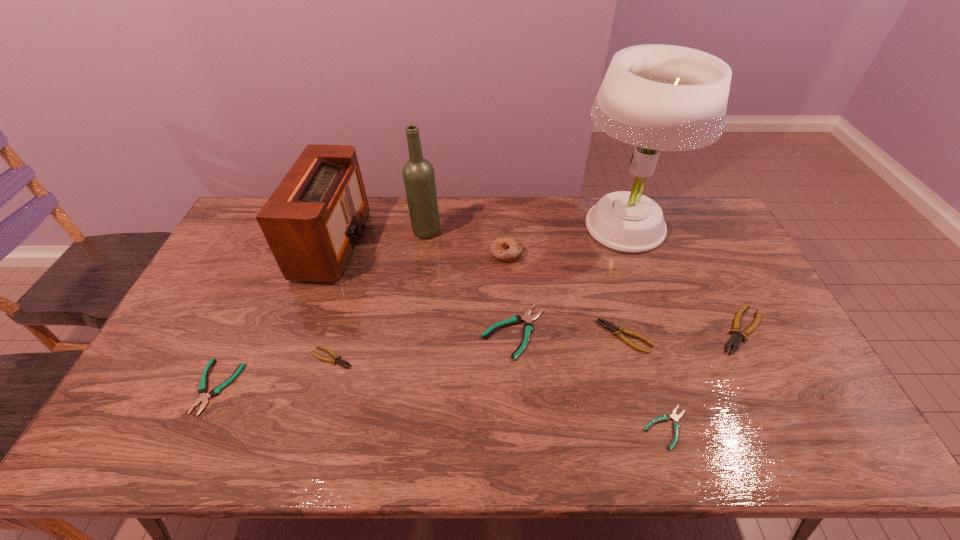
At what (x,y) coordinates should I click in order to perform the action: click on object present at the near edge. Please return your answer as a coordinate pair (x, y). The width and height of the screenshot is (960, 540). Looking at the image, I should click on (676, 425).

The image size is (960, 540). In order to click on object that is at the left edge in this screenshot , I will do `click(202, 389)`.

You are a GUI agent. You are given a task and a screenshot of the screen. Output one action in this format:
    pyautogui.click(x=<x>, y=<y>)
    Task: Click on the object present at the right edge
    The image size is (960, 540).
    Given the screenshot: What is the action you would take?
    pyautogui.click(x=735, y=339)

Find the location of a particular element. Image resolution: width=960 pixels, height=540 pixels. vacant position at the far edge of the desktop is located at coordinates (576, 212).

The width and height of the screenshot is (960, 540). Identify the location of vacant space at the near edge. (756, 432).

Locate an element on the screen. This screenshot has height=540, width=960. vacant region at the left edge is located at coordinates (228, 312).

You are a GUI agent. You are given a task and a screenshot of the screen. Output one action in this format:
    pyautogui.click(x=<x>, y=<y>)
    Task: Click on the blank space at the right edge
    This screenshot has height=540, width=960.
    Given the screenshot: What is the action you would take?
    pyautogui.click(x=703, y=253)

Where is `free area in between the fourth tallest object and the biggest teal pliers`? This screenshot has height=540, width=960. free area in between the fourth tallest object and the biggest teal pliers is located at coordinates (510, 293).

This screenshot has height=540, width=960. Identify the location of unoccupied area between the smallest teal pliers and the radio receiver. (500, 335).

The image size is (960, 540). I want to click on vacant point located between the leftmost yellow pliers and the fifth tallest object, so click(x=537, y=344).